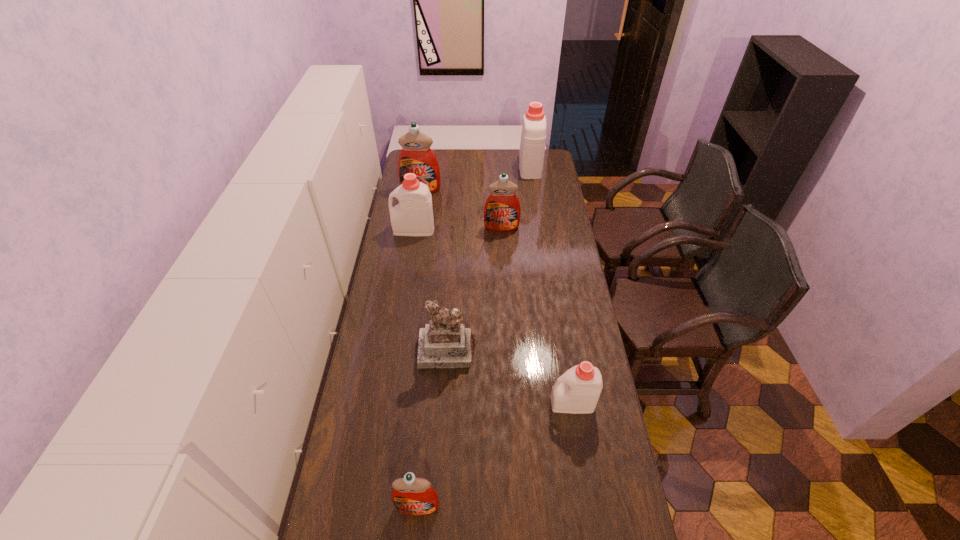
Locate an element on the screen. the nearest white detergent is located at coordinates (577, 391).

The width and height of the screenshot is (960, 540). I want to click on the nearest red detergent, so click(413, 496).

Where is `the nearest object`? The image size is (960, 540). the nearest object is located at coordinates (413, 496).

I want to click on vacant region located 0.050m on the handle side of the farthest object, so click(x=528, y=151).

Identify the location of free space located on the handle side of the farthest object. Image resolution: width=960 pixels, height=540 pixels. (527, 150).

You are a GUI agent. You are given a task and a screenshot of the screen. Output one action in this format:
    pyautogui.click(x=<x>, y=<y>)
    Task: Click on the vacant space located 0.390m on the front surface of the biggest red detergent
    This screenshot has height=540, width=960.
    Given the screenshot: What is the action you would take?
    pyautogui.click(x=412, y=245)

You are a GUI agent. You are given a task and a screenshot of the screen. Output one action in this format:
    pyautogui.click(x=<x>, y=<y>)
    Task: Click on the blank area located on the front surface of the second biggest red detergent
    This screenshot has height=540, width=960.
    Given the screenshot: What is the action you would take?
    pyautogui.click(x=505, y=285)

I want to click on free space located 0.240m on the front-facing side of the figurine, so click(x=442, y=434).

This screenshot has height=540, width=960. What are the coordinates of `free spot located on the handle side of the sixth farthest object` in the screenshot? It's located at 452,403.

I want to click on free point located 0.280m on the handle side of the sixth farthest object, so click(467, 403).